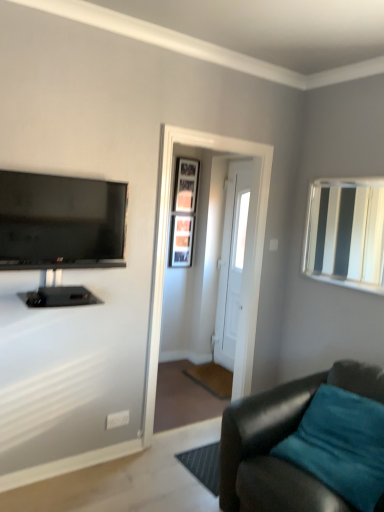
Question: Is white wooden door at center inside white glossy mirror at upper right?

Choices:
 (A) no
 (B) yes

Answer: (A)

Question: From a real-world perspective, does white glossy mirror at upper right stand above white wooden door at center?

Choices:
 (A) no
 (B) yes

Answer: (B)

Question: Is white glossy mirror at upper right at the right side of white wooden door at center?

Choices:
 (A) yes
 (B) no

Answer: (A)

Question: From the image's perspective, is white glossy mirror at upper right located above white wooden door at center?

Choices:
 (A) no
 (B) yes

Answer: (B)

Question: Is white glossy mirror at upper right taller than white wooden door at center?

Choices:
 (A) yes
 (B) no

Answer: (B)

Question: Does white glossy mirror at upper right touch white wooden door at center?

Choices:
 (A) yes
 (B) no

Answer: (B)

Question: Considering the relative sizes of wooden picture frame at center, which is the 2th picture frame from top to bottom, and white glossy mirror at upper right in the image provided, is wooden picture frame at center, which is the 2th picture frame from top to bottom, smaller than white glossy mirror at upper right?

Choices:
 (A) yes
 (B) no

Answer: (A)

Question: Is wooden picture frame at center, which is the 2th picture frame from top to bottom, directly adjacent to white glossy mirror at upper right?

Choices:
 (A) yes
 (B) no

Answer: (B)

Question: Considering the relative sizes of wooden picture frame at center, which is the 2th picture frame from top to bottom, and white glossy mirror at upper right in the image provided, is wooden picture frame at center, which is the 2th picture frame from top to bottom, shorter than white glossy mirror at upper right?

Choices:
 (A) no
 (B) yes

Answer: (B)

Question: Is wooden picture frame at center, positioned as the first picture frame in bottom-to-top order, not near white glossy mirror at upper right?

Choices:
 (A) yes
 (B) no

Answer: (A)

Question: Is wooden picture frame at center, positioned as the first picture frame in bottom-to-top order, turned away from white glossy mirror at upper right?

Choices:
 (A) yes
 (B) no

Answer: (B)

Question: Is wooden picture frame at center, which is the 2th picture frame from top to bottom, to the left of white glossy mirror at upper right from the viewer's perspective?

Choices:
 (A) yes
 (B) no

Answer: (A)

Question: From a real-world perspective, is white glossy mirror at upper right beneath wooden framed picture at center, the 1th picture frame from the top?

Choices:
 (A) yes
 (B) no

Answer: (A)